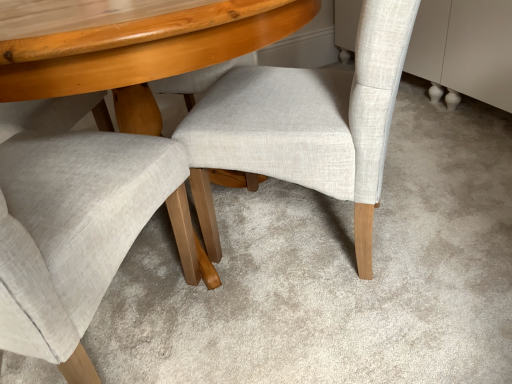
Question: Which direction should I rotate to look at light beige fabric chair at center, marked as the first chair in a right-to-left arrangement, — up or down?

Choices:
 (A) up
 (B) down

Answer: (A)

Question: Is light gray fabric chair at center, which ranks as the 1th chair in left-to-right order, to the right of light beige fabric chair at center, marked as the first chair in a right-to-left arrangement, from the viewer's perspective?

Choices:
 (A) yes
 (B) no

Answer: (B)

Question: Would you say light beige fabric chair at center, which appears as the second chair when viewed from the left, is part of light gray fabric chair at center, which ranks as the 1th chair in left-to-right order,'s contents?

Choices:
 (A) no
 (B) yes

Answer: (A)

Question: Can you confirm if light gray fabric chair at center, which ranks as the 1th chair in left-to-right order, is taller than light beige fabric chair at center, which appears as the second chair when viewed from the left?

Choices:
 (A) no
 (B) yes

Answer: (B)

Question: Is the depth of light gray fabric chair at center, which ranks as the 1th chair in left-to-right order, less than that of light beige fabric chair at center, marked as the first chair in a right-to-left arrangement?

Choices:
 (A) no
 (B) yes

Answer: (B)

Question: Is light gray fabric chair at center, which ranks as the 1th chair in left-to-right order, far from light beige fabric chair at center, which appears as the second chair when viewed from the left?

Choices:
 (A) yes
 (B) no

Answer: (B)

Question: From a real-world perspective, is light gray fabric chair at center, the second chair viewed from the right, under light beige fabric chair at center, marked as the first chair in a right-to-left arrangement?

Choices:
 (A) no
 (B) yes

Answer: (A)

Question: Considering the relative sizes of light beige fabric chair at center, marked as the first chair in a right-to-left arrangement, and light gray fabric chair at center, the second chair viewed from the right, in the image provided, is light beige fabric chair at center, marked as the first chair in a right-to-left arrangement, thinner than light gray fabric chair at center, the second chair viewed from the right,?

Choices:
 (A) no
 (B) yes

Answer: (B)

Question: Does light beige fabric chair at center, marked as the first chair in a right-to-left arrangement, come behind light gray fabric chair at center, the second chair viewed from the right?

Choices:
 (A) yes
 (B) no

Answer: (A)

Question: Is light beige fabric chair at center, marked as the first chair in a right-to-left arrangement, turned away from light gray fabric chair at center, the second chair viewed from the right?

Choices:
 (A) no
 (B) yes

Answer: (A)

Question: From a real-world perspective, is light beige fabric chair at center, marked as the first chair in a right-to-left arrangement, over light gray fabric chair at center, the second chair viewed from the right?

Choices:
 (A) no
 (B) yes

Answer: (A)

Question: Considering the relative sizes of light beige fabric chair at center, marked as the first chair in a right-to-left arrangement, and light gray fabric chair at center, the second chair viewed from the right, in the image provided, is light beige fabric chair at center, marked as the first chair in a right-to-left arrangement, bigger than light gray fabric chair at center, the second chair viewed from the right,?

Choices:
 (A) no
 (B) yes

Answer: (A)

Question: Considering the relative sizes of light beige fabric chair at center, which appears as the second chair when viewed from the left, and light gray fabric chair at center, which ranks as the 1th chair in left-to-right order, in the image provided, is light beige fabric chair at center, which appears as the second chair when viewed from the left, shorter than light gray fabric chair at center, which ranks as the 1th chair in left-to-right order,?

Choices:
 (A) yes
 (B) no

Answer: (A)

Question: Choose the correct answer: Is light beige fabric chair at center, which appears as the second chair when viewed from the left, inside light gray fabric chair at center, which ranks as the 1th chair in left-to-right order, or outside it?

Choices:
 (A) inside
 (B) outside

Answer: (B)